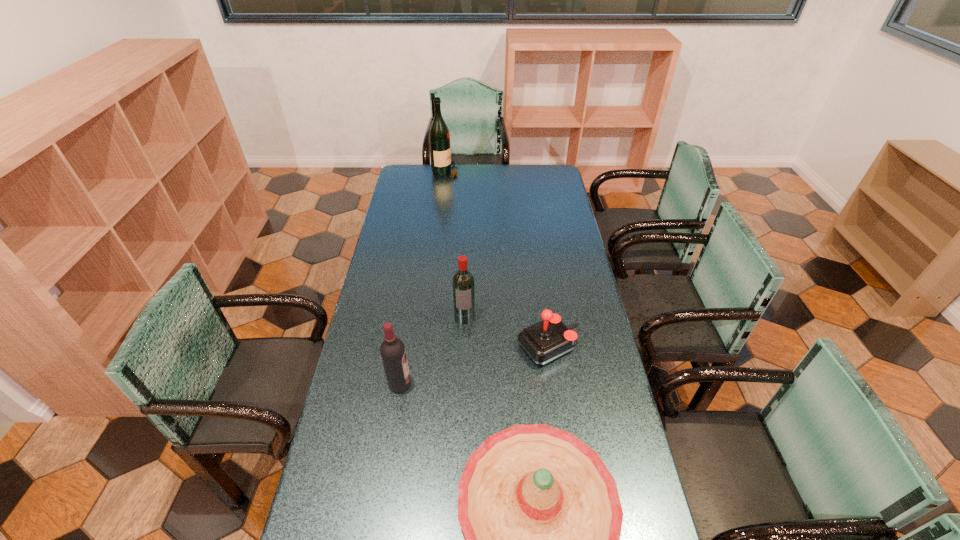
This screenshot has height=540, width=960. In order to click on vacant space that satisfies the following two spatial constraints: 1. on the front side of the joystick; 2. on the label of the nearest wine bottle in this screenshot , I will do `click(554, 384)`.

At what (x,y) coordinates should I click in order to perform the action: click on free space that satisfies the following two spatial constraints: 1. on the label of the rightmost wine bottle; 2. on the label of the nearest wine bottle. Please return your answer as a coordinate pair (x, y). This screenshot has width=960, height=540. Looking at the image, I should click on (463, 384).